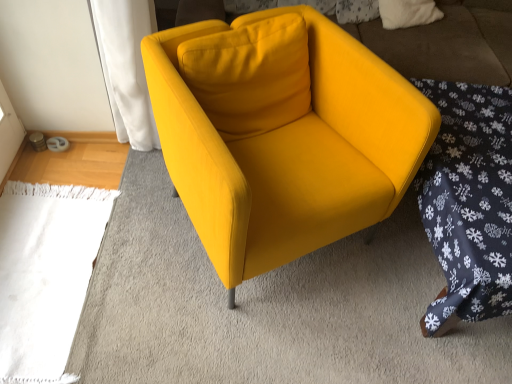
Question: Would you say matte yellow armchair at center is part of dark blue snowflake-patterned fabric at lower right's contents?

Choices:
 (A) yes
 (B) no

Answer: (B)

Question: Does dark blue snowflake-patterned fabric at lower right have a greater height compared to matte yellow armchair at center?

Choices:
 (A) no
 (B) yes

Answer: (A)

Question: Could you tell me if dark blue snowflake-patterned fabric at lower right is facing matte yellow armchair at center?

Choices:
 (A) no
 (B) yes

Answer: (A)

Question: Is dark blue snowflake-patterned fabric at lower right facing away from matte yellow armchair at center?

Choices:
 (A) no
 (B) yes

Answer: (A)

Question: Does dark blue snowflake-patterned fabric at lower right have a smaller size compared to matte yellow armchair at center?

Choices:
 (A) no
 (B) yes

Answer: (B)

Question: Is dark blue snowflake-patterned fabric at lower right thinner than matte yellow armchair at center?

Choices:
 (A) no
 (B) yes

Answer: (A)

Question: Considering the relative sizes of matte yellow armchair at center and dark blue snowflake-patterned fabric at lower right in the image provided, is matte yellow armchair at center smaller than dark blue snowflake-patterned fabric at lower right?

Choices:
 (A) no
 (B) yes

Answer: (A)

Question: Is matte yellow armchair at center placed right next to dark blue snowflake-patterned fabric at lower right?

Choices:
 (A) no
 (B) yes

Answer: (A)

Question: Is there a large distance between matte yellow armchair at center and dark blue snowflake-patterned fabric at lower right?

Choices:
 (A) yes
 (B) no

Answer: (B)

Question: Would you say matte yellow armchair at center contains dark blue snowflake-patterned fabric at lower right?

Choices:
 (A) no
 (B) yes

Answer: (A)

Question: From the image's perspective, is matte yellow armchair at center beneath dark blue snowflake-patterned fabric at lower right?

Choices:
 (A) no
 (B) yes

Answer: (A)

Question: Can you confirm if matte yellow armchair at center is taller than dark blue snowflake-patterned fabric at lower right?

Choices:
 (A) yes
 (B) no

Answer: (A)

Question: Is matte yellow armchair at center wider or thinner than dark blue snowflake-patterned fabric at lower right?

Choices:
 (A) thin
 (B) wide

Answer: (A)